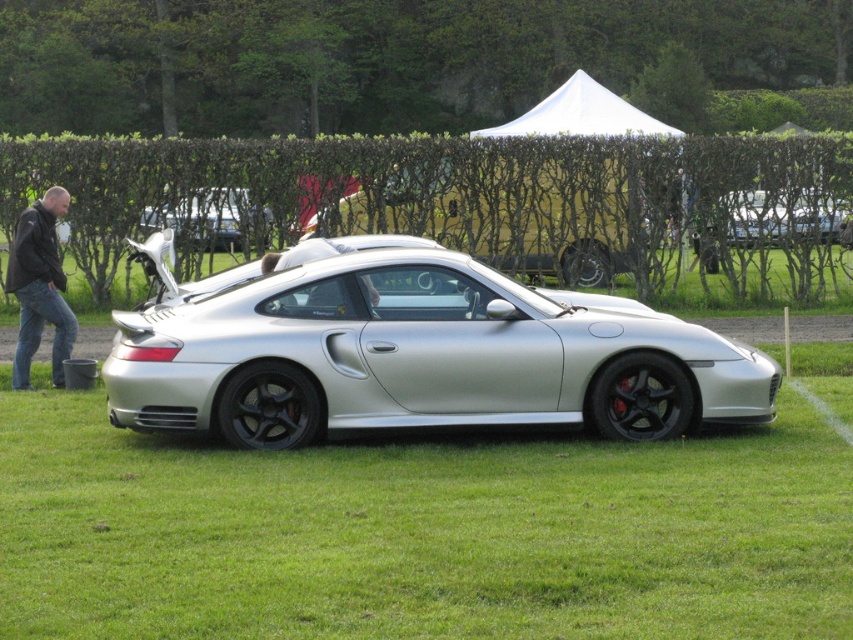
Can you confirm if green grass at center is thinner than satin silver car at center?

Yes, green grass at center is thinner than satin silver car at center.

What do you see at coordinates (412, 531) in the screenshot?
I see `green grass at center` at bounding box center [412, 531].

Locate an element on the screen. This screenshot has width=853, height=640. green grass at center is located at coordinates (412, 531).

Identify the location of green grass at center. (412, 531).

Does jeans at left have a greater height compared to satin silver car at center?

Yes.

Which of these two, jeans at left or satin silver car at center, stands shorter?

With less height is satin silver car at center.

This screenshot has width=853, height=640. What do you see at coordinates (39, 285) in the screenshot? I see `jeans at left` at bounding box center [39, 285].

At what (x,y) coordinates should I click in order to perform the action: click on jeans at left. Please return your answer as a coordinate pair (x, y). Looking at the image, I should click on (39, 285).

Is green grass at center bigger than jeans at left?

No, green grass at center is not bigger than jeans at left.

Who is more distant from viewer, [189,508] or [38,216]?

The point [38,216] is more distant.

Find the location of a particular element. This screenshot has width=853, height=640. green grass at center is located at coordinates (412, 531).